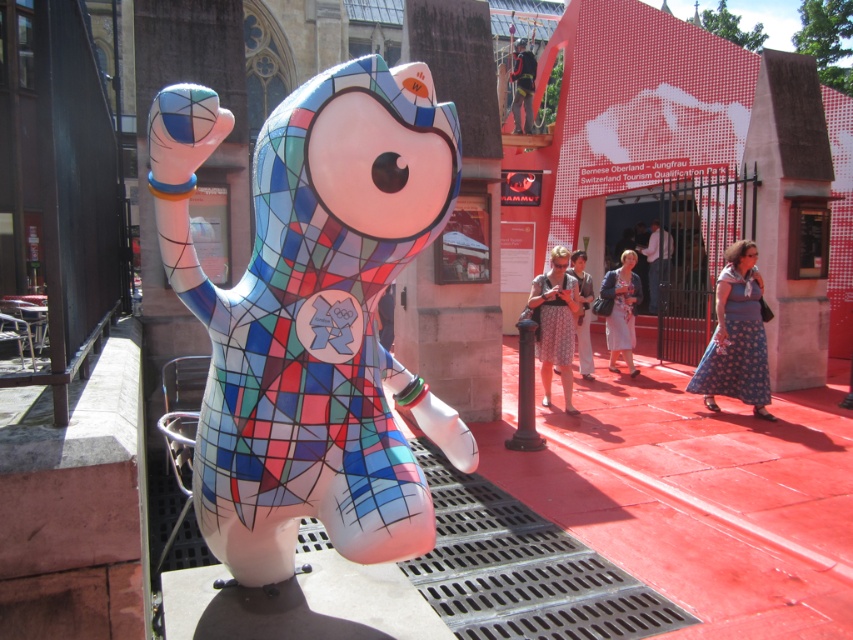
Who is lower down, patterned fabric dress at center or blue floral dress at center?

patterned fabric dress at center is below.

Is patterned fabric dress at center to the left of blue floral dress at center from the viewer's perspective?

Yes, patterned fabric dress at center is to the left of blue floral dress at center.

Is point (554, 324) closer to viewer compared to point (618, 282)?

Yes, point (554, 324) is closer to viewer.

Identify the location of patterned fabric dress at center. (556, 323).

Which is in front, point (552, 356) or point (529, 67)?

Point (552, 356) is in front.

Who is lower down, patterned fabric dress at center or dark blue fabric pants at center?

patterned fabric dress at center is below.

Does point (561, 355) come closer to viewer compared to point (517, 97)?

Yes, it is in front of point (517, 97).

Where is `patterned fabric dress at center`? The width and height of the screenshot is (853, 640). patterned fabric dress at center is located at coordinates (556, 323).

Between matte blue dress at center and blue fabric dress at center, which one has more height?

With more height is blue fabric dress at center.

Is point (589, 276) closer to camera compared to point (653, 291)?

Yes, it is in front of point (653, 291).

Between point (567, 269) and point (647, 250), which one is positioned behind?

Positioned behind is point (647, 250).

This screenshot has height=640, width=853. Identify the location of matte blue dress at center. (582, 312).